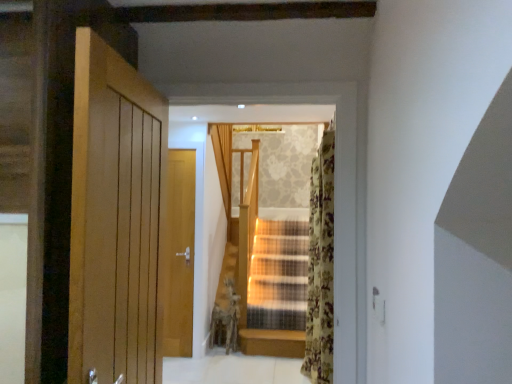
What do you see at coordinates (320, 266) in the screenshot? The width and height of the screenshot is (512, 384). I see `floral fabric curtain at right, which appears as the second curtain when viewed from the left` at bounding box center [320, 266].

Measure the distance between floral fabric curtain at right, the 2th curtain in the back-to-front sequence, and camera.

The depth of floral fabric curtain at right, the 2th curtain in the back-to-front sequence, is 8.07 feet.

The height and width of the screenshot is (384, 512). What are the coordinates of `floral fabric curtain at right, the 2th curtain in the back-to-front sequence` in the screenshot? It's located at (320, 266).

This screenshot has height=384, width=512. In order to click on light beige fabric curtain at center, which is counted as the 2th curtain, starting from the front in this screenshot , I will do `click(223, 164)`.

What is the approximate height of light beige fabric curtain at center, which is counted as the 2th curtain, starting from the front?

light beige fabric curtain at center, which is counted as the 2th curtain, starting from the front, is 1.24 meters in height.

Looking at this image, in order to face light beige fabric curtain at center, which is counted as the 2th curtain, starting from the front, should I rotate leftwards or rightwards?

Rotate your view left by about 4.989°.

Describe the element at coordinates (223, 164) in the screenshot. The width and height of the screenshot is (512, 384). I see `light beige fabric curtain at center, which is counted as the 2th curtain, starting from the front` at that location.

Consider the image. What is the approximate width of light beige fabric curtain at center, the 2th curtain viewed from the right?

The width of light beige fabric curtain at center, the 2th curtain viewed from the right, is 8.28 centimeters.

Where is `floral fabric curtain at right, which appears as the second curtain when viewed from the left`? floral fabric curtain at right, which appears as the second curtain when viewed from the left is located at coordinates tap(320, 266).

Visually, is light beige fabric curtain at center, arranged as the 1th curtain when viewed from the back, positioned to the left or to the right of floral fabric curtain at right, the 1th curtain positioned from the front?

light beige fabric curtain at center, arranged as the 1th curtain when viewed from the back, is positioned on floral fabric curtain at right, the 1th curtain positioned from the front,'s left side.

Which is in front, light beige fabric curtain at center, the 2th curtain viewed from the right, or floral fabric curtain at right, which is the first curtain in right-to-left order?

floral fabric curtain at right, which is the first curtain in right-to-left order, is in front.

Is point (229, 225) closer or farther from the camera than point (319, 272)?

Clearly, point (229, 225) is more distant from the camera than point (319, 272).

From the image's perspective, is light beige fabric curtain at center, the 2th curtain viewed from the right, above floral fabric curtain at right, the 2th curtain in the back-to-front sequence?

Yes, from the image's perspective, light beige fabric curtain at center, the 2th curtain viewed from the right, is on top of floral fabric curtain at right, the 2th curtain in the back-to-front sequence.

From a real-world perspective, which is physically below, light beige fabric curtain at center, the 2th curtain viewed from the right, or floral fabric curtain at right, the 1th curtain positioned from the front?

floral fabric curtain at right, the 1th curtain positioned from the front.

Consider the image. Between light beige fabric curtain at center, which is counted as the 2th curtain, starting from the front, and floral fabric curtain at right, which appears as the second curtain when viewed from the left, which one has larger width?

floral fabric curtain at right, which appears as the second curtain when viewed from the left, is wider.

Which of these two, light beige fabric curtain at center, which is the first curtain from left to right, or floral fabric curtain at right, which appears as the second curtain when viewed from the left, stands shorter?

light beige fabric curtain at center, which is the first curtain from left to right, is shorter.

Does light beige fabric curtain at center, arranged as the 1th curtain when viewed from the back, have a smaller size compared to floral fabric curtain at right, the 1th curtain positioned from the front?

No, light beige fabric curtain at center, arranged as the 1th curtain when viewed from the back, is not smaller than floral fabric curtain at right, the 1th curtain positioned from the front.

Could floral fabric curtain at right, which appears as the second curtain when viewed from the left, be considered to be inside light beige fabric curtain at center, which is counted as the 2th curtain, starting from the front?

No, light beige fabric curtain at center, which is counted as the 2th curtain, starting from the front, does not contain floral fabric curtain at right, which appears as the second curtain when viewed from the left.

Are light beige fabric curtain at center, arranged as the 1th curtain when viewed from the back, and floral fabric curtain at right, the 1th curtain positioned from the front, beside each other?

light beige fabric curtain at center, arranged as the 1th curtain when viewed from the back, and floral fabric curtain at right, the 1th curtain positioned from the front, are not in contact.

Could you tell me if light beige fabric curtain at center, arranged as the 1th curtain when viewed from the back, is facing floral fabric curtain at right, which appears as the second curtain when viewed from the left?

No, light beige fabric curtain at center, arranged as the 1th curtain when viewed from the back, is not facing towards floral fabric curtain at right, which appears as the second curtain when viewed from the left.

From the picture: Can you tell me how much light beige fabric curtain at center, arranged as the 1th curtain when viewed from the back, and floral fabric curtain at right, which is the first curtain in right-to-left order, differ in facing direction?

The angular difference between light beige fabric curtain at center, arranged as the 1th curtain when viewed from the back, and floral fabric curtain at right, which is the first curtain in right-to-left order, is 1.78 degrees.

Measure the distance between light beige fabric curtain at center, the 2th curtain viewed from the right, and floral fabric curtain at right, the 1th curtain positioned from the front.

light beige fabric curtain at center, the 2th curtain viewed from the right, and floral fabric curtain at right, the 1th curtain positioned from the front, are 1.47 meters apart.

The height and width of the screenshot is (384, 512). Find the location of `curtain on the right of light beige fabric curtain at center, arranged as the 1th curtain when viewed from the back`. curtain on the right of light beige fabric curtain at center, arranged as the 1th curtain when viewed from the back is located at coordinates (320, 266).

Based on their positions, is floral fabric curtain at right, the 2th curtain in the back-to-front sequence, located to the left or right of light beige fabric curtain at center, which is the first curtain from left to right?

floral fabric curtain at right, the 2th curtain in the back-to-front sequence, is to the right of light beige fabric curtain at center, which is the first curtain from left to right.

Which object is closer to the camera, floral fabric curtain at right, which is the first curtain in right-to-left order, or light beige fabric curtain at center, which is the first curtain from left to right?

Positioned in front is floral fabric curtain at right, which is the first curtain in right-to-left order.

Which is less distant, (314, 176) or (225, 179)?

The point (314, 176) is in front.

From the image's perspective, between floral fabric curtain at right, the 1th curtain positioned from the front, and light beige fabric curtain at center, the 2th curtain viewed from the right, who is located below?

floral fabric curtain at right, the 1th curtain positioned from the front.

From a real-world perspective, is floral fabric curtain at right, which appears as the second curtain when viewed from the left, on top of light beige fabric curtain at center, the 2th curtain viewed from the right?

Incorrect, from a real-world perspective, floral fabric curtain at right, which appears as the second curtain when viewed from the left, is lower than light beige fabric curtain at center, the 2th curtain viewed from the right.

Looking at their sizes, would you say floral fabric curtain at right, the 1th curtain positioned from the front, is wider or thinner than light beige fabric curtain at center, which is the first curtain from left to right?

In the image, floral fabric curtain at right, the 1th curtain positioned from the front, appears to be wider than light beige fabric curtain at center, which is the first curtain from left to right.

In terms of height, does floral fabric curtain at right, which is the first curtain in right-to-left order, look taller or shorter compared to light beige fabric curtain at center, which is counted as the 2th curtain, starting from the front?

floral fabric curtain at right, which is the first curtain in right-to-left order, is taller than light beige fabric curtain at center, which is counted as the 2th curtain, starting from the front.

Considering the sizes of objects floral fabric curtain at right, which is the first curtain in right-to-left order, and light beige fabric curtain at center, which is counted as the 2th curtain, starting from the front, in the image provided, who is bigger, floral fabric curtain at right, which is the first curtain in right-to-left order, or light beige fabric curtain at center, which is counted as the 2th curtain, starting from the front,?

light beige fabric curtain at center, which is counted as the 2th curtain, starting from the front, is bigger.

Do you think floral fabric curtain at right, which is the first curtain in right-to-left order, is within light beige fabric curtain at center, the 2th curtain viewed from the right, or outside of it?

floral fabric curtain at right, which is the first curtain in right-to-left order, is not enclosed by light beige fabric curtain at center, the 2th curtain viewed from the right.

Is floral fabric curtain at right, the 1th curtain positioned from the front, positioned far away from light beige fabric curtain at center, which is counted as the 2th curtain, starting from the front?

That's right, there is a large distance between floral fabric curtain at right, the 1th curtain positioned from the front, and light beige fabric curtain at center, which is counted as the 2th curtain, starting from the front.

Could you tell me if floral fabric curtain at right, which is the first curtain in right-to-left order, is turned towards light beige fabric curtain at center, the 2th curtain viewed from the right?

No.

Find the location of a particular element. The image size is (512, 384). curtain lying on the right of light beige fabric curtain at center, the 2th curtain viewed from the right is located at coordinates (320, 266).

The image size is (512, 384). In the image, there is a light beige fabric curtain at center, which is counted as the 2th curtain, starting from the front. What are the coordinates of `curtain below it (from a real-world perspective)` in the screenshot? It's located at (320, 266).

I want to click on curtain on the left of floral fabric curtain at right, the 1th curtain positioned from the front, so [223, 164].